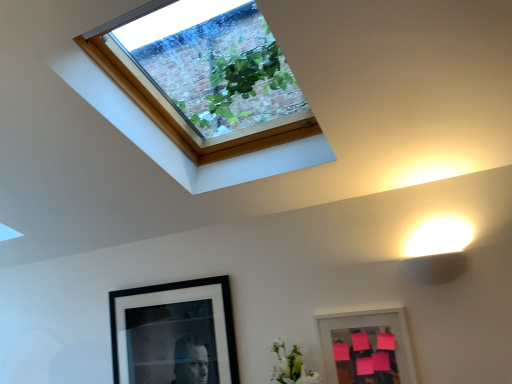
Question: Is black matte picture frame at lower left, which is the 1th picture frame in back-to-front order, outside pink matte picture frame at lower right, which is the second picture frame in left-to-right order?

Choices:
 (A) yes
 (B) no

Answer: (A)

Question: From the image's perspective, is black matte picture frame at lower left, the first picture frame when ordered from left to right, above pink matte picture frame at lower right, the 1th picture frame when ordered from front to back?

Choices:
 (A) yes
 (B) no

Answer: (B)

Question: From a real-world perspective, does black matte picture frame at lower left, which is the second picture frame from right to left, stand above pink matte picture frame at lower right, the second picture frame viewed from the back?

Choices:
 (A) yes
 (B) no

Answer: (A)

Question: Is black matte picture frame at lower left, the second picture frame in the front-to-back sequence, next to pink matte picture frame at lower right, the second picture frame viewed from the back?

Choices:
 (A) yes
 (B) no

Answer: (B)

Question: Can you confirm if black matte picture frame at lower left, which is the 1th picture frame in back-to-front order, is positioned to the right of pink matte picture frame at lower right, the 1th picture frame when ordered from right to left?

Choices:
 (A) no
 (B) yes

Answer: (A)

Question: In terms of height, does clear glass window at upper center look taller or shorter compared to black matte picture frame at lower left, which is the second picture frame from right to left?

Choices:
 (A) short
 (B) tall

Answer: (A)

Question: Choose the correct answer: Is clear glass window at upper center inside black matte picture frame at lower left, which is the 1th picture frame in back-to-front order, or outside it?

Choices:
 (A) inside
 (B) outside

Answer: (B)

Question: From a real-world perspective, is clear glass window at upper center above or below black matte picture frame at lower left, the first picture frame when ordered from left to right?

Choices:
 (A) below
 (B) above

Answer: (B)

Question: In terms of size, does clear glass window at upper center appear bigger or smaller than black matte picture frame at lower left, the first picture frame when ordered from left to right?

Choices:
 (A) big
 (B) small

Answer: (A)

Question: Is black matte picture frame at lower left, the second picture frame in the front-to-back sequence, wider or thinner than pink matte picture frame at lower right, the second picture frame viewed from the back?

Choices:
 (A) wide
 (B) thin

Answer: (A)

Question: From their relative heights in the image, would you say black matte picture frame at lower left, which is the 1th picture frame in back-to-front order, is taller or shorter than pink matte picture frame at lower right, the second picture frame viewed from the back?

Choices:
 (A) short
 (B) tall

Answer: (B)

Question: Considering the positions of point (199, 279) and point (333, 367), is point (199, 279) closer or farther from the camera than point (333, 367)?

Choices:
 (A) farther
 (B) closer

Answer: (A)

Question: Is black matte picture frame at lower left, which is the second picture frame from right to left, in front of or behind pink matte picture frame at lower right, which is the second picture frame in left-to-right order, in the image?

Choices:
 (A) behind
 (B) front

Answer: (A)

Question: Relative to white matte flower at lower center, is black matte picture frame at lower left, which is the 1th picture frame in back-to-front order, in front or behind?

Choices:
 (A) behind
 (B) front

Answer: (A)

Question: Is point (119, 314) positioned closer to the camera than point (285, 375)?

Choices:
 (A) farther
 (B) closer

Answer: (A)